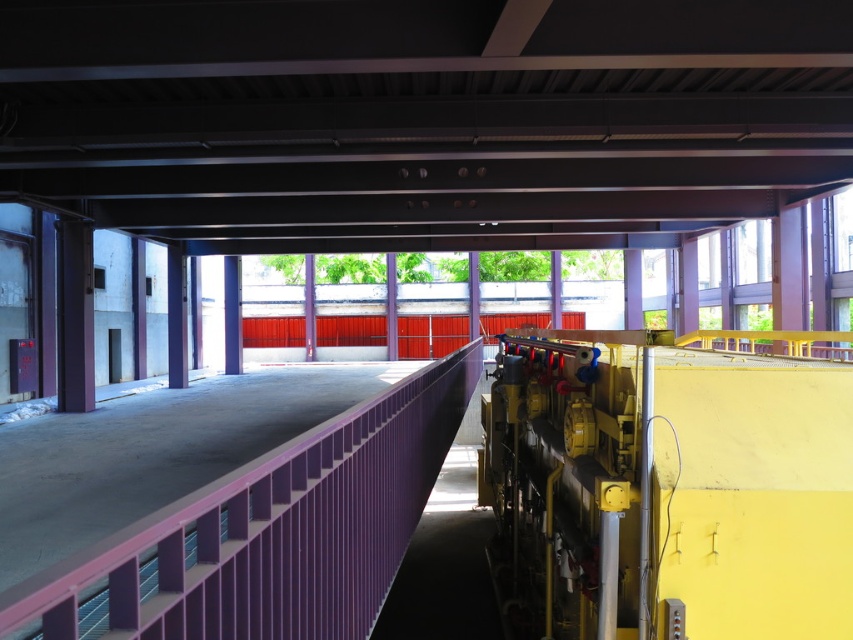
Question: Among these objects, which one is nearest to the camera?

Choices:
 (A) purple metallic rail at center
 (B) purple metal/rail at center

Answer: (A)

Question: Does metal at center have a smaller size compared to purple metallic rail at center?

Choices:
 (A) no
 (B) yes

Answer: (A)

Question: Which is nearer to the purple metal/rail at center?

Choices:
 (A) purple metallic rail at center
 (B) metal at center

Answer: (B)

Question: Which point appears farthest from the camera in this image?

Choices:
 (A) click(263, 3)
 (B) click(347, 428)
 (C) click(231, 369)

Answer: (C)

Question: Does metal at center have a greater width compared to purple metallic rail at center?

Choices:
 (A) yes
 (B) no

Answer: (A)

Question: Can you confirm if metal at center is positioned below purple metal/rail at center?

Choices:
 (A) yes
 (B) no

Answer: (B)